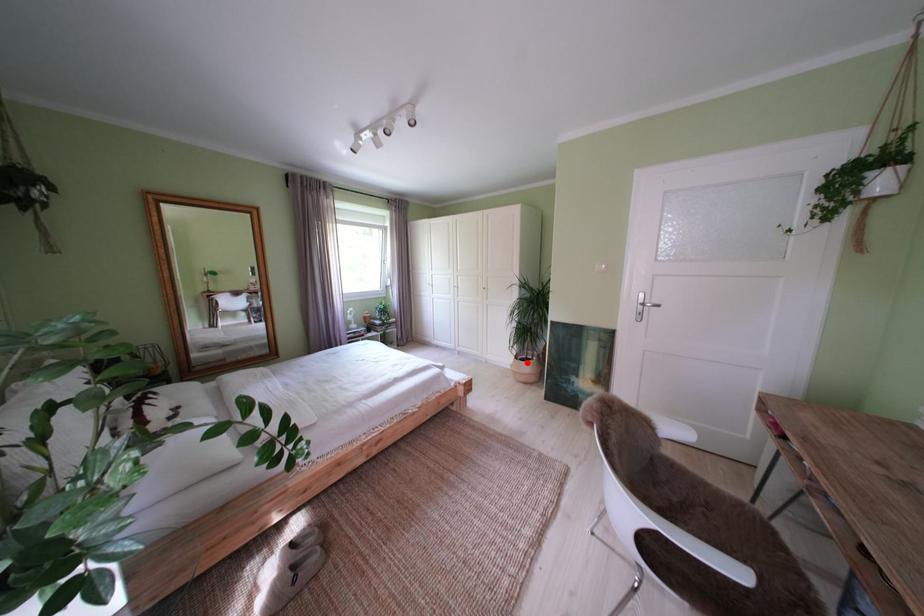
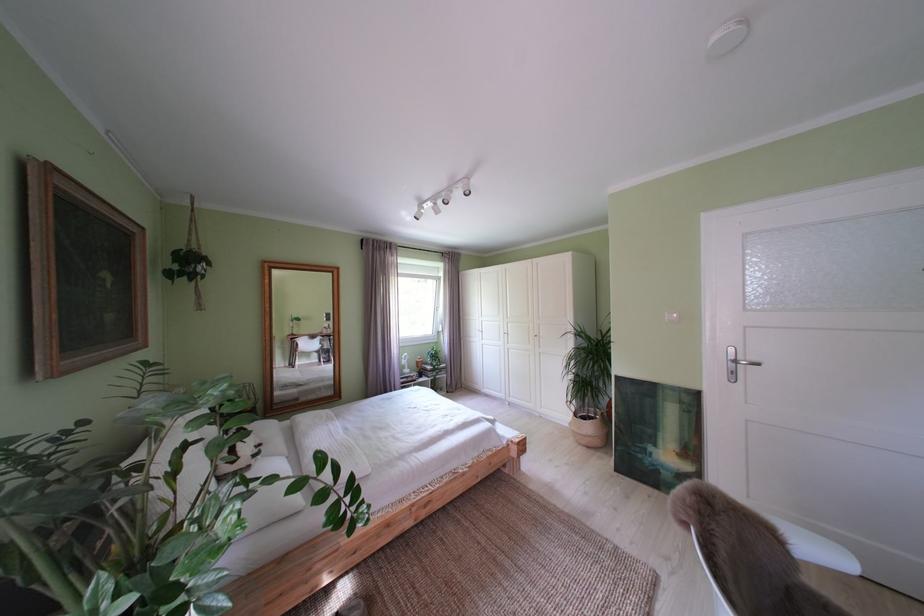
In the second image, find the point that corresponds to the highlighted location in the first image.

(587, 419)